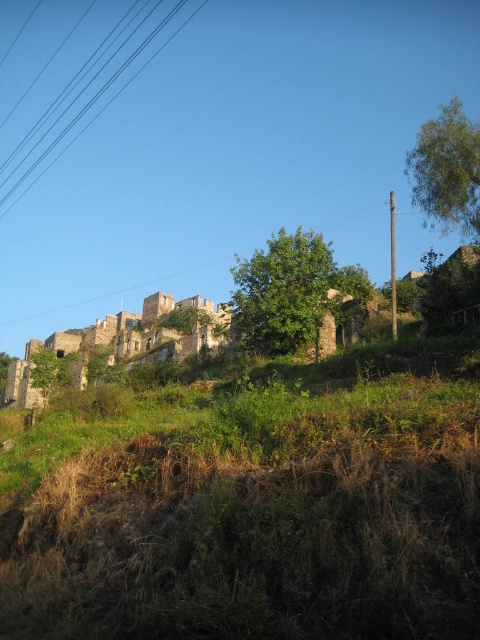
You are a photographer planning to capture the stone ruins in the center of the image. You notice the green grassy at upper left and the brown wooden power line at upper center in the background. Which object takes up more space in the frame?

The brown wooden power line at upper center takes up more space in the frame than the green grassy at upper left, as the grassy area is smaller in size compared to the power line.

You are a bird flying over the ruins. You notice the green grassy at upper left and the black wire at upper left. Which one is positioned to the right from your perspective?

The green grassy at upper left is to the right of the black wire at upper left, so from the bird flying over the ruins perspective, the green grassy at upper left is positioned to the right of the black wire at upper left.